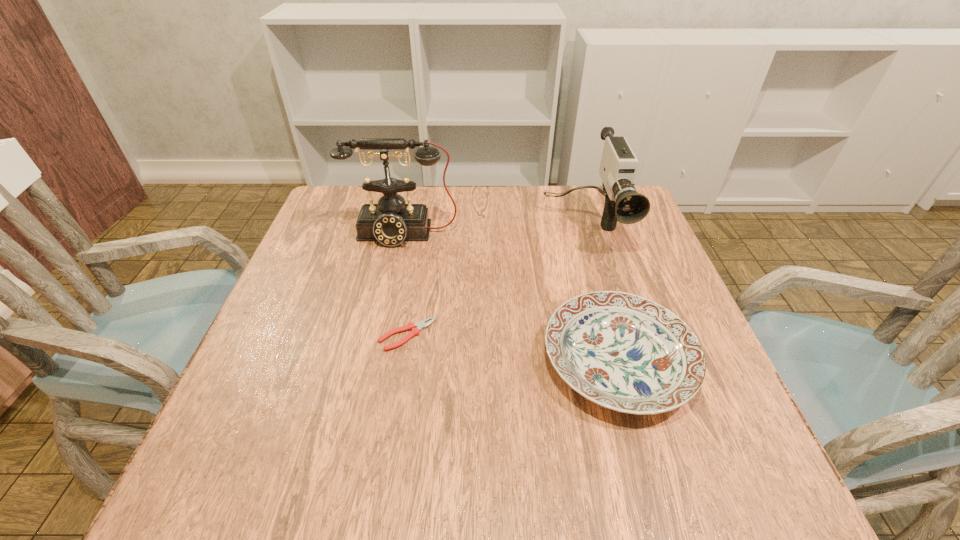
You are a GUI agent. You are given a task and a screenshot of the screen. Output one action in this format:
    pyautogui.click(x=<x>, y=<y>)
    Task: Click on the free space at the far right corner of the desktop
    The height and width of the screenshot is (540, 960).
    Given the screenshot: What is the action you would take?
    pyautogui.click(x=594, y=220)

At what (x,y) coordinates should I click in order to perform the action: click on free space that is in between the telephone and the plate. Please return your answer as a coordinate pair (x, y). Looking at the image, I should click on (510, 298).

Where is `free space between the shortest object and the tallest object`? free space between the shortest object and the tallest object is located at coordinates (405, 285).

You are a GUI agent. You are given a task and a screenshot of the screen. Output one action in this format:
    pyautogui.click(x=<x>, y=<y>)
    Task: Click on the empty location between the telephone and the plate
    This screenshot has height=540, width=960.
    Given the screenshot: What is the action you would take?
    pyautogui.click(x=510, y=298)

Locate an element on the screen. The width and height of the screenshot is (960, 540). empty location between the third shortest object and the pliers is located at coordinates (495, 281).

Identify the location of empty space that is in between the shortest object and the third shortest object. (495, 281).

Where is `vacant space that is in between the camcorder and the pliers`? The height and width of the screenshot is (540, 960). vacant space that is in between the camcorder and the pliers is located at coordinates (495, 281).

Where is `free spot between the tallest object and the camcorder`? The width and height of the screenshot is (960, 540). free spot between the tallest object and the camcorder is located at coordinates (492, 231).

Locate an element on the screen. This screenshot has height=540, width=960. empty location between the telephone and the camcorder is located at coordinates (492, 231).

Select which object appears as the second closest to the second shortest object. Please provide its 2D coordinates. Your answer should be formatted as a tuple, i.e. [(x, y)], where the tuple contains the x and y coordinates of a point satisfying the conditions above.

[(415, 328)]